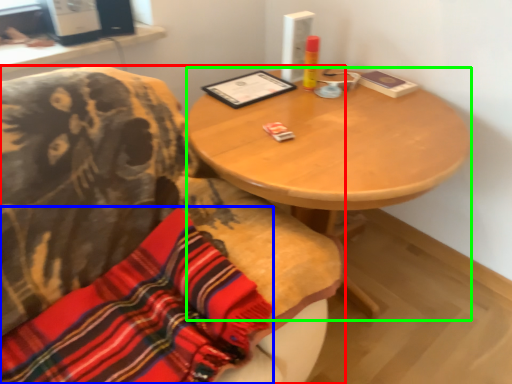
Question: Which object is the farthest from chair (highlighted by a red box)? Choose among these: cloth (highlighted by a blue box) or desk (highlighted by a green box).

Choices:
 (A) cloth
 (B) desk

Answer: (B)